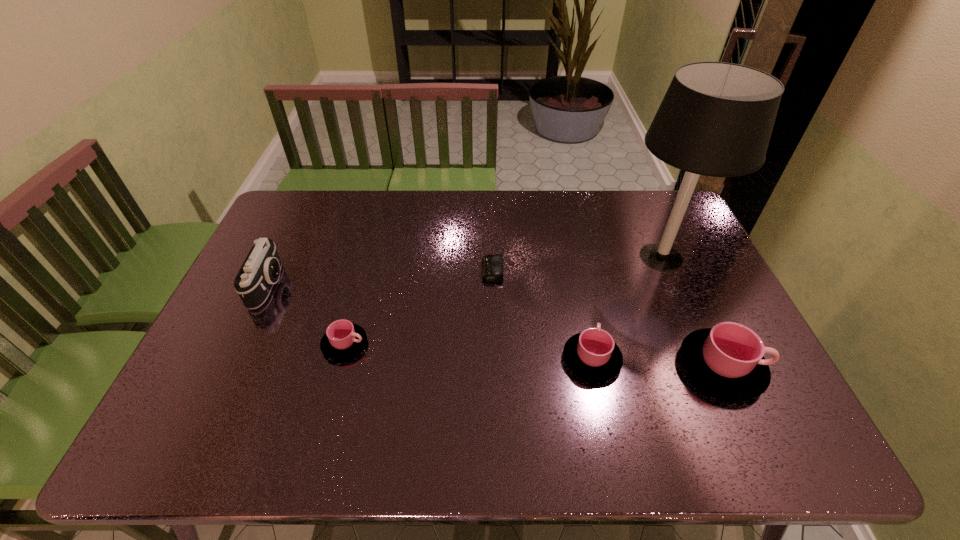
Locate an element on the screen. vacant space in between the third object from left to right and the tallest object is located at coordinates (577, 264).

Where is `vacant area that lies between the second tallest cup and the tallest object`? The height and width of the screenshot is (540, 960). vacant area that lies between the second tallest cup and the tallest object is located at coordinates (627, 308).

Image resolution: width=960 pixels, height=540 pixels. Identify the location of free spot between the fourth object from left to right and the leftmost object. (430, 322).

Identify the location of unoccupied position between the shortest cup and the shortest object. This screenshot has width=960, height=540. (419, 307).

The width and height of the screenshot is (960, 540). What are the coordinates of `unoccupied area between the fourth shortest object and the second tallest object` in the screenshot? It's located at (495, 326).

Identify the location of vacant space in between the rightmost cup and the shortest object. (607, 319).

You are a GUI agent. You are given a task and a screenshot of the screen. Output one action in this format:
    pyautogui.click(x=<x>, y=<y>)
    Task: Click on the unoccupied position between the third shortest object and the shortest object
    The image size is (960, 540).
    Given the screenshot: What is the action you would take?
    pyautogui.click(x=542, y=315)

You are a GUI agent. You are given a task and a screenshot of the screen. Output one action in this format:
    pyautogui.click(x=<x>, y=<y>)
    Task: Click on the vacant point located between the second shortest cup and the shortest object
    This screenshot has height=540, width=960.
    Given the screenshot: What is the action you would take?
    542,315

Where is `blank region between the tallest cup and the third object from left to right`? The width and height of the screenshot is (960, 540). blank region between the tallest cup and the third object from left to right is located at coordinates (607, 319).

Identify the location of blank region between the fourth object from left to right and the rightmost cup. (657, 363).